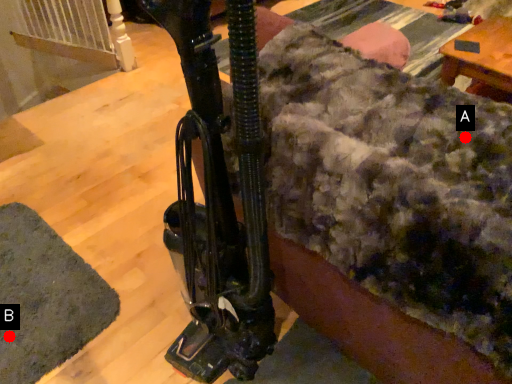
Question: Two points are circled on the image, labeled by A and B beside each circle. Among these points, which one is nearest to the camera?

Choices:
 (A) A is closer
 (B) B is closer

Answer: (A)